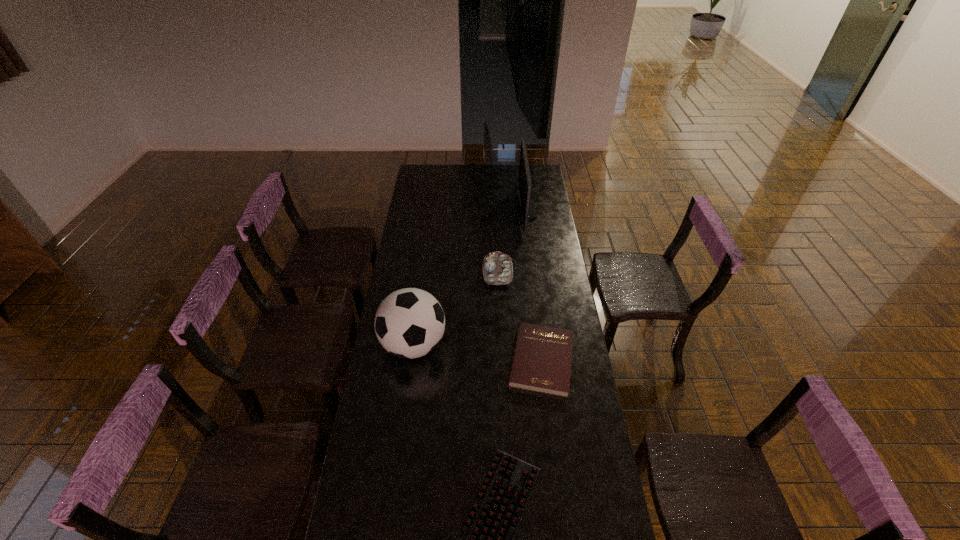
Locate an element on the screen. Image resolution: width=960 pixels, height=540 pixels. vacant space located 0.250m on the right of the second farthest object is located at coordinates (564, 272).

The image size is (960, 540). In order to click on blank space located on the back of the hardback book in this screenshot , I will do [536, 310].

Image resolution: width=960 pixels, height=540 pixels. What are the coordinates of `object that is at the left edge` in the screenshot? It's located at (409, 323).

Where is `monitor that is at the right edge`? monitor that is at the right edge is located at coordinates (525, 206).

At what (x,y) coordinates should I click in order to perform the action: click on hardback book at the right edge. Please return your answer as a coordinate pair (x, y). Looking at the image, I should click on (542, 358).

Locate an element on the screen. The height and width of the screenshot is (540, 960). blank area at the far edge is located at coordinates (496, 184).

You are a GUI agent. You are given a task and a screenshot of the screen. Output one action in this format:
    pyautogui.click(x=<x>, y=<y>)
    Task: Click on the vacant space at the left edge of the desktop
    Image resolution: width=960 pixels, height=540 pixels.
    Given the screenshot: What is the action you would take?
    pyautogui.click(x=420, y=191)

What are the coordinates of `vacant space at the right edge of the desktop` in the screenshot? It's located at (546, 281).

The height and width of the screenshot is (540, 960). In the image, there is a desktop. Find the location of `free space at the far left corner`. free space at the far left corner is located at coordinates (425, 165).

What are the coordinates of `vacant area at the far right corner of the desktop` in the screenshot? It's located at (541, 171).